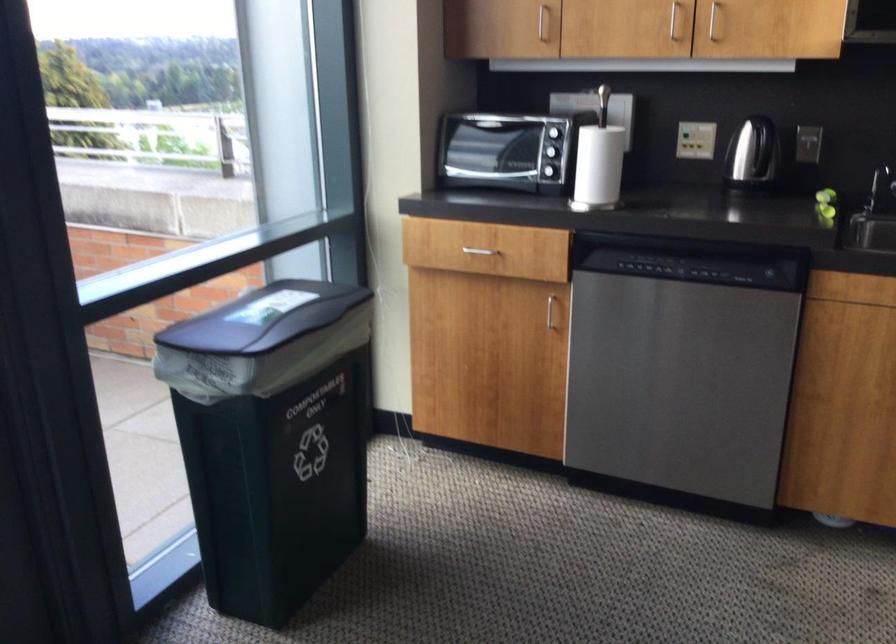
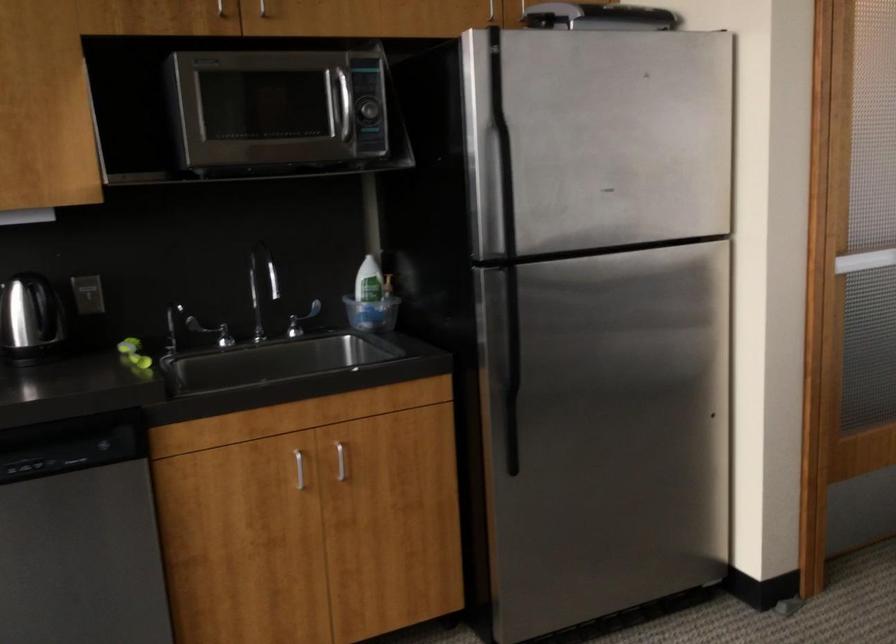
Question: Based on the continuous images, in which direction is the camera rotating? Reply with the corresponding letter.

Choices:
 (A) Left
 (B) Right
 (C) Up
 (D) Down

Answer: (B)